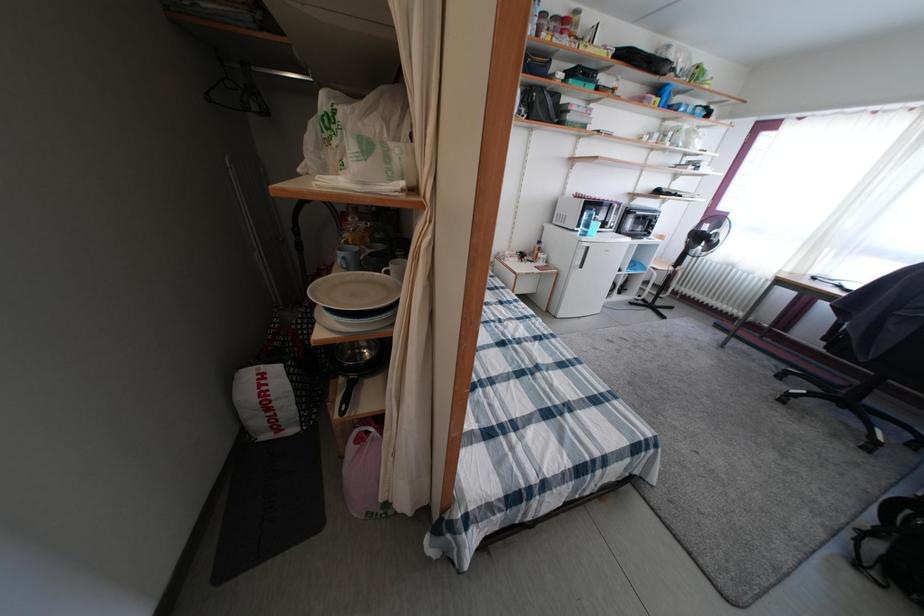
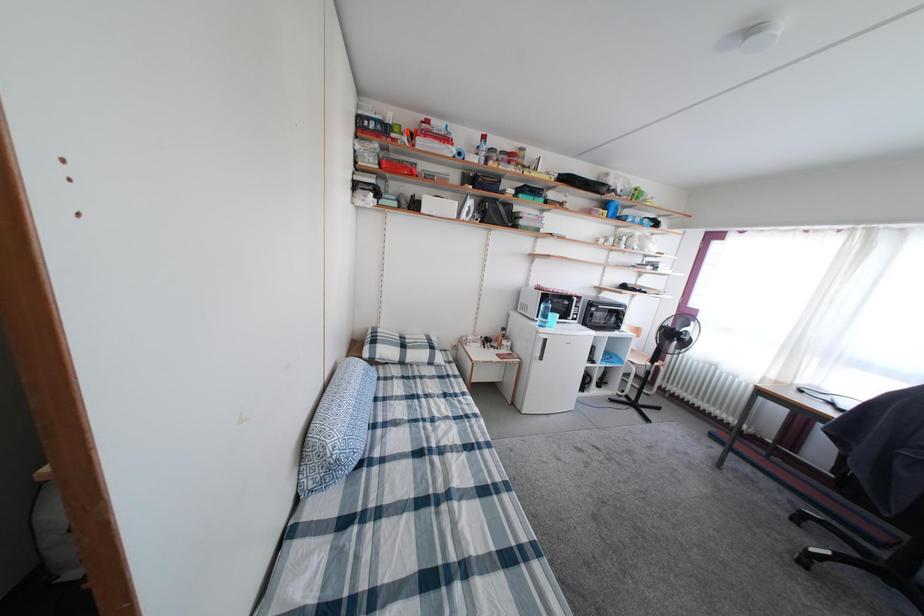
Question: The images are taken continuously from a first-person perspective. In which direction is your viewpoint rotating?

Choices:
 (A) Left
 (B) Right
 (C) Up
 (D) Down

Answer: (C)